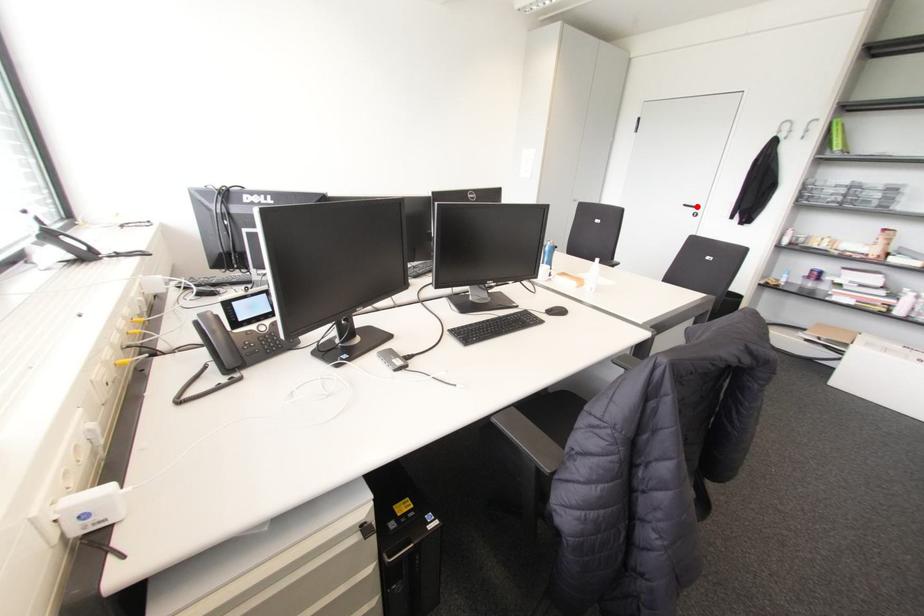
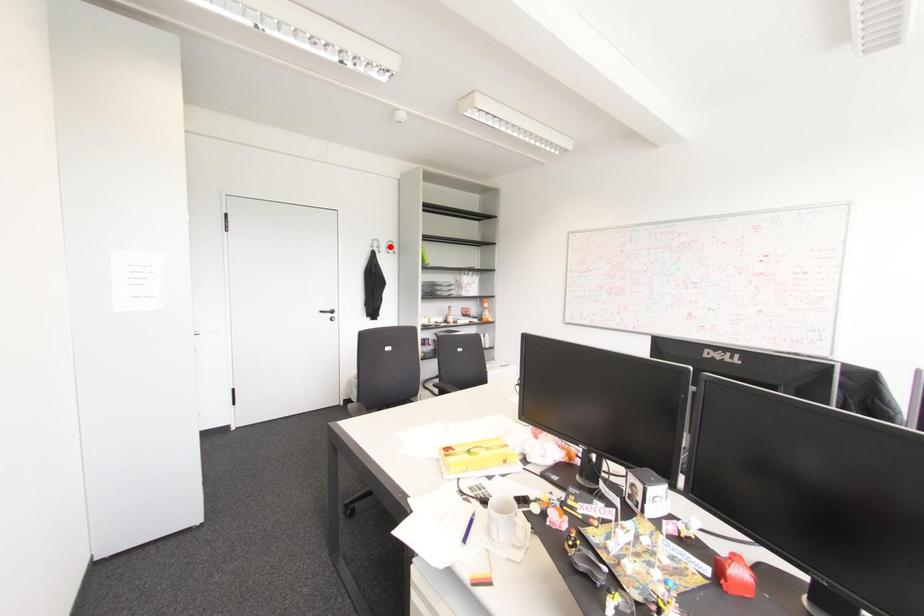
Looking at this image, I am providing you with two images of the same scene from different viewpoints. A red point is marked on the first image and another point is marked on the second image. Are the points marked in image1 and image2 representing the same 3D position?

No